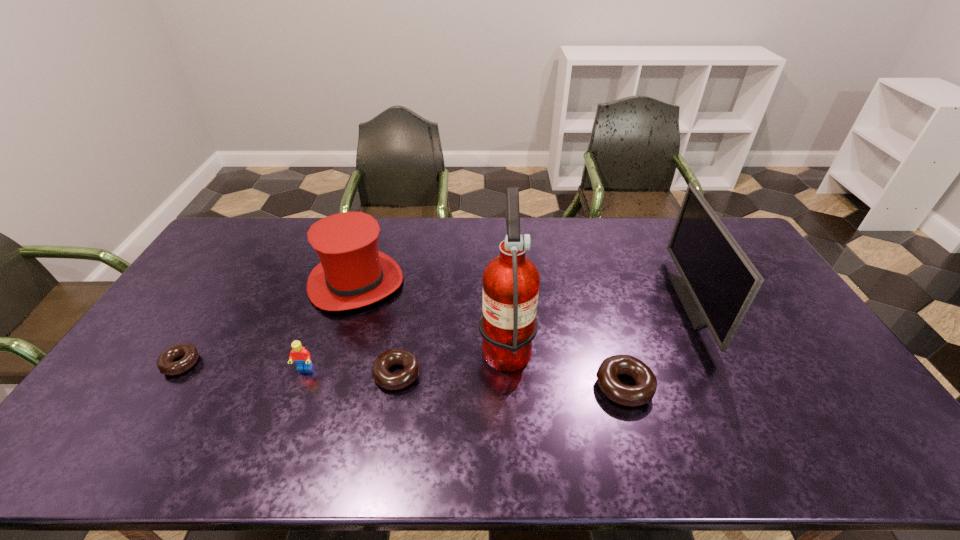
This screenshot has width=960, height=540. Find the location of `vacant space located 0.210m on the screen side of the rightmost object`. vacant space located 0.210m on the screen side of the rightmost object is located at coordinates (615, 302).

This screenshot has height=540, width=960. Find the location of `free spot located on the front of the fifth shortest object`. free spot located on the front of the fifth shortest object is located at coordinates (313, 417).

Find the location of a particular element. The image size is (960, 540). vacant space located 0.100m on the face of the fourth shortest object is located at coordinates (291, 406).

You are a GUI agent. You are given a task and a screenshot of the screen. Output one action in this format:
    pyautogui.click(x=<x>, y=<y>)
    Task: Click on the object that is at the far edge
    
    Given the screenshot: What is the action you would take?
    pyautogui.click(x=353, y=273)

Find the location of a particular element. object positioned at the left edge is located at coordinates (165, 364).

This screenshot has height=540, width=960. In order to click on free space at the far edge of the desktop in this screenshot , I will do `click(312, 249)`.

The height and width of the screenshot is (540, 960). In the image, there is a desktop. Identify the location of free space at the near edge. (226, 405).

Locate an element on the screen. The height and width of the screenshot is (540, 960). vacant region at the left edge of the desktop is located at coordinates (221, 268).

I want to click on free spot at the right edge of the desktop, so click(x=792, y=314).

At what (x,y) coordinates should I click in order to perform the action: click on vacant space in between the shortest object and the second doughnut from right to left. Please return your answer as a coordinate pair (x, y). The width and height of the screenshot is (960, 540). Looking at the image, I should click on (289, 368).